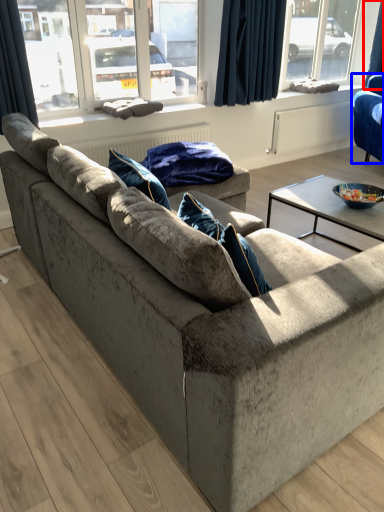
Question: Which of the following is the closest to the observer, curtain (highlighted by a red box) or studio couch (highlighted by a blue box)?

Choices:
 (A) curtain
 (B) studio couch

Answer: (B)